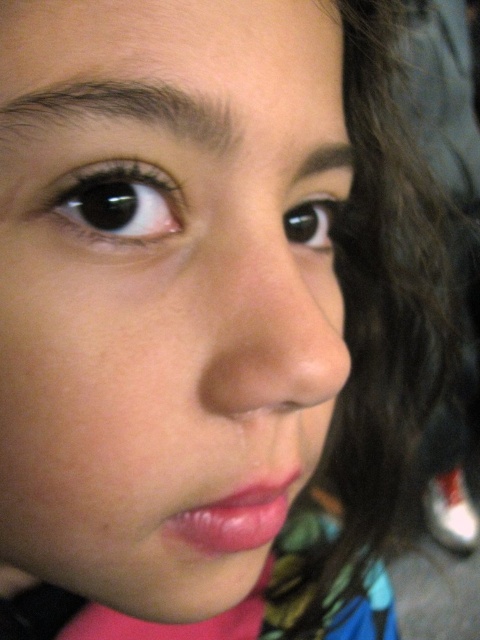
Question: Which of the following is the farthest from the observer?

Choices:
 (A) black glossy eye at upper left
 (B) smooth skin face at center
 (C) dark brown eyebrow at upper center
 (D) black glossy eye at center

Answer: (D)

Question: Among these objects, which one is farthest from the camera?

Choices:
 (A) black glossy eye at center
 (B) dark brown hair at upper left

Answer: (A)

Question: Does dark brown hair at upper left lie behind black glossy eye at center?

Choices:
 (A) yes
 (B) no

Answer: (B)

Question: Can you confirm if black glossy eye at upper left is wider than dark brown hair at upper left?

Choices:
 (A) no
 (B) yes

Answer: (A)

Question: Estimate the real-world distances between objects in this image. Which object is closer to the dark brown hair at upper left?

Choices:
 (A) dark brown eyebrow at upper center
 (B) smooth skin face at center
 (C) black glossy eye at upper left

Answer: (C)

Question: Can you confirm if smooth skin face at center is positioned to the left of dark brown eyebrow at upper center?

Choices:
 (A) yes
 (B) no

Answer: (A)